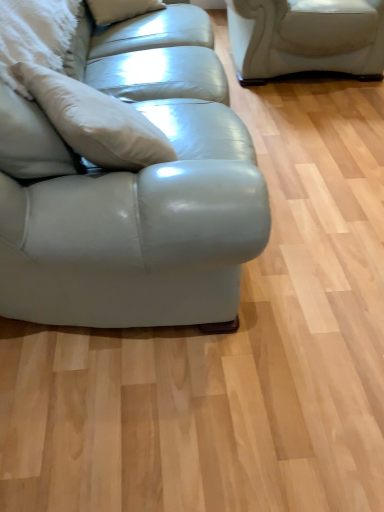
The height and width of the screenshot is (512, 384). Identify the location of white fluffy pillow at left. (39, 36).

What do you see at coordinates (39, 36) in the screenshot?
I see `white fluffy pillow at left` at bounding box center [39, 36].

What is the approximate width of white fluffy pillow at left?

white fluffy pillow at left is 14.42 inches in width.

This screenshot has height=512, width=384. Identify the location of satin beige couch at left. (133, 197).

The width and height of the screenshot is (384, 512). What do you see at coordinates (133, 197) in the screenshot? I see `satin beige couch at left` at bounding box center [133, 197].

Where is `white fluffy pillow at left`? The image size is (384, 512). white fluffy pillow at left is located at coordinates (39, 36).

Can you confirm if white fluffy pillow at left is positioned to the right of satin beige couch at left?

In fact, white fluffy pillow at left is to the left of satin beige couch at left.

Which object is further away from the camera taking this photo, white fluffy pillow at left or satin beige couch at left?

white fluffy pillow at left is further away from the camera.

Does point (18, 10) lie behind point (200, 226)?

That is True.

From the image's perspective, is white fluffy pillow at left located above or below satin beige couch at left?

Based on their image positions, white fluffy pillow at left is located above satin beige couch at left.

Consider the image. From a real-world perspective, is white fluffy pillow at left positioned over satin beige couch at left based on gravity?

Correct, in the physical world, white fluffy pillow at left is higher than satin beige couch at left.

Between white fluffy pillow at left and satin beige couch at left, which one has smaller width?

white fluffy pillow at left is thinner.

Does white fluffy pillow at left have a greater height compared to satin beige couch at left?

No, white fluffy pillow at left is not taller than satin beige couch at left.

From the picture: Is white fluffy pillow at left bigger or smaller than satin beige couch at left?

Clearly, white fluffy pillow at left is larger in size than satin beige couch at left.

Does white fluffy pillow at left contain satin beige couch at left?

No, satin beige couch at left is located outside of white fluffy pillow at left.

Is white fluffy pillow at left not near satin beige couch at left?

No, white fluffy pillow at left is not far from satin beige couch at left.

Consider the image. Could you tell me if white fluffy pillow at left is facing satin beige couch at left?

Yes, white fluffy pillow at left faces towards satin beige couch at left.

How different are the orientations of white fluffy pillow at left and satin beige couch at left in degrees?

34.9 degrees.

How far apart are white fluffy pillow at left and satin beige couch at left?

They are 13.75 inches apart.

Where is `pillow above the satin beige couch at left (from a real-world perspective)`? pillow above the satin beige couch at left (from a real-world perspective) is located at coordinates (39, 36).

Which object is positioned more to the left, satin beige couch at left or white fluffy pillow at left?

Positioned to the left is white fluffy pillow at left.

Between satin beige couch at left and white fluffy pillow at left, which one is positioned behind?

white fluffy pillow at left is further away from the camera.

Between point (168, 54) and point (42, 53), which one is positioned behind?

Point (168, 54)

From the image's perspective, is satin beige couch at left on white fluffy pillow at left?

No, from the image's perspective, satin beige couch at left is not over white fluffy pillow at left.

From a real-world perspective, is satin beige couch at left positioned under white fluffy pillow at left based on gravity?

Yes, from a real-world perspective, satin beige couch at left is below white fluffy pillow at left.

From the picture: Does satin beige couch at left have a lesser width compared to white fluffy pillow at left?

No.

From their relative heights in the image, would you say satin beige couch at left is taller or shorter than white fluffy pillow at left?

In the image, satin beige couch at left appears to be taller than white fluffy pillow at left.

Is satin beige couch at left bigger than white fluffy pillow at left?

No, satin beige couch at left is not bigger than white fluffy pillow at left.

Would you say satin beige couch at left is inside or outside white fluffy pillow at left?

satin beige couch at left lies outside white fluffy pillow at left.

Is satin beige couch at left with white fluffy pillow at left?

No, satin beige couch at left is not touching white fluffy pillow at left.

Consider the image. Is satin beige couch at left positioned with its back to white fluffy pillow at left?

No, white fluffy pillow at left is not at the back of satin beige couch at left.

Based on the photo, how different are the orientations of satin beige couch at left and white fluffy pillow at left in degrees?

The angle between the facing direction of satin beige couch at left and the facing direction of white fluffy pillow at left is 34.9 degrees.

Where is `studio couch lying on the right of white fluffy pillow at left`? The width and height of the screenshot is (384, 512). studio couch lying on the right of white fluffy pillow at left is located at coordinates coord(133,197).

You are a GUI agent. You are given a task and a screenshot of the screen. Output one action in this format:
    pyautogui.click(x=<x>, y=<y>)
    Task: Click on the studio couch on the right of white fluffy pillow at left
    
    Given the screenshot: What is the action you would take?
    pyautogui.click(x=133, y=197)

At what (x,y) coordinates should I click in order to perform the action: click on studio couch in front of the white fluffy pillow at left. Please return your answer as a coordinate pair (x, y). The width and height of the screenshot is (384, 512). Looking at the image, I should click on (133, 197).